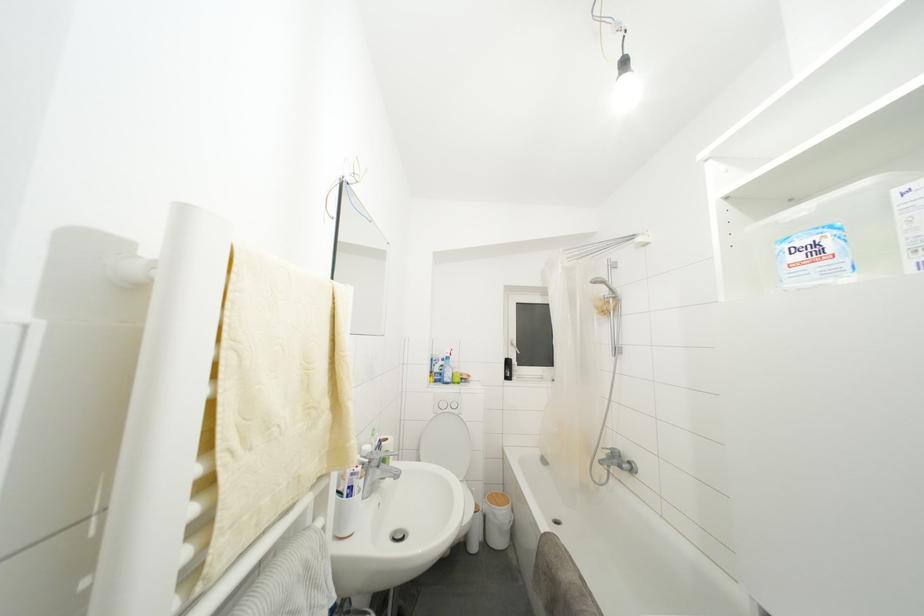
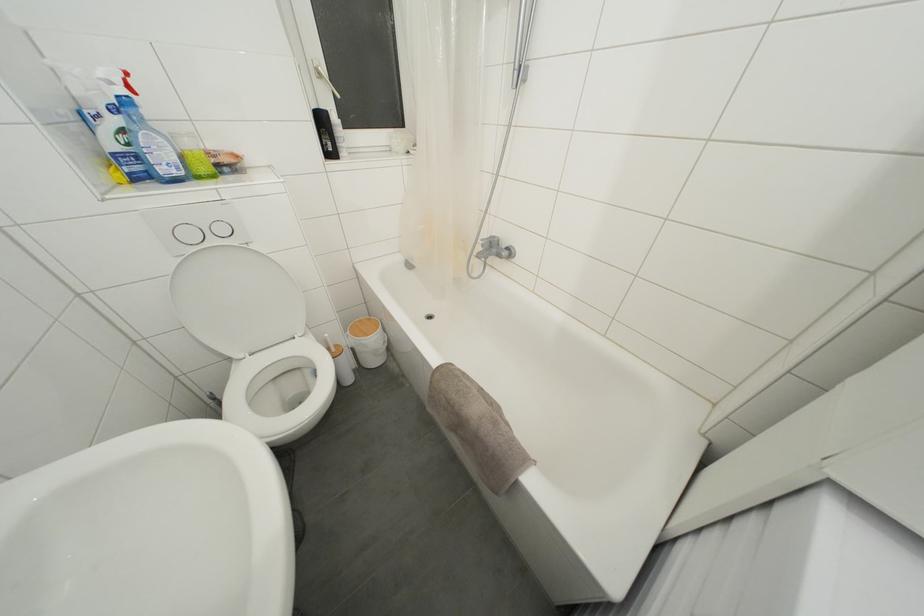
Locate, in the second image, the point that corresponds to (517,350) in the first image.

(323, 79)